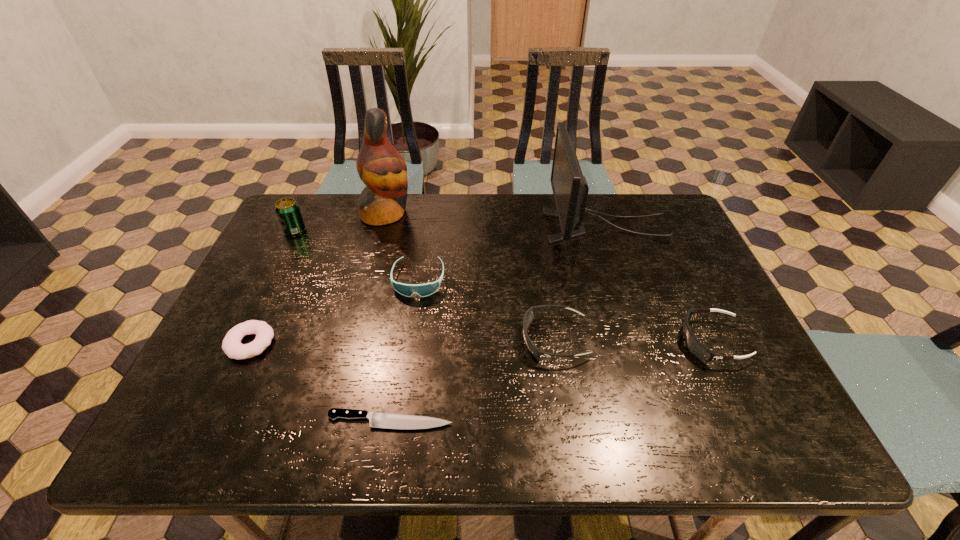
Image resolution: width=960 pixels, height=540 pixels. I want to click on goggles that can be found as the third closest to the nearest object, so click(x=693, y=344).

Where is `free spot that satisfies the following two spatial constraints: 1. on the front side of the beer can; 2. on the left side of the shortest object`? free spot that satisfies the following two spatial constraints: 1. on the front side of the beer can; 2. on the left side of the shortest object is located at coordinates (203, 421).

The image size is (960, 540). In order to click on free space that satisfies the following two spatial constraints: 1. on the face of the tallest object; 2. on the front side of the third tallest object in this screenshot , I will do `click(382, 231)`.